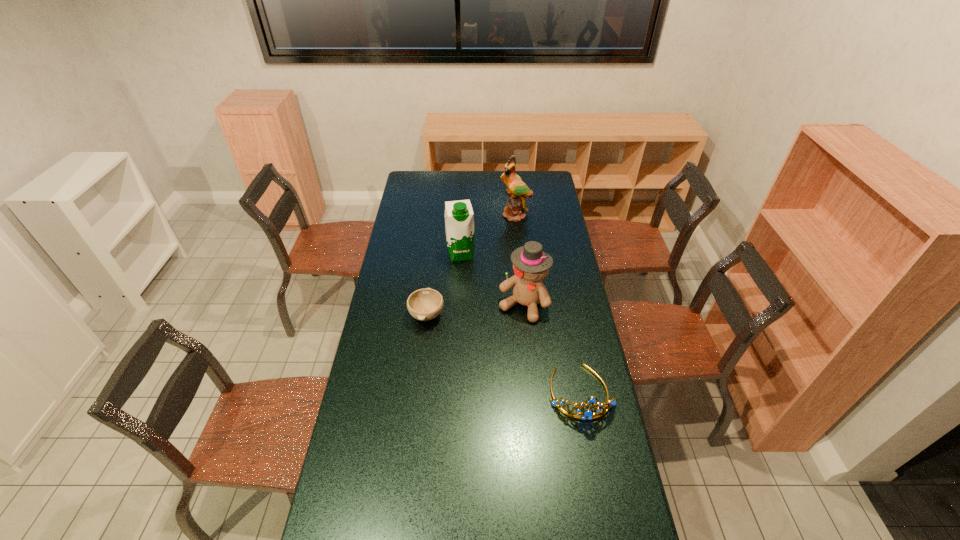
The height and width of the screenshot is (540, 960). I want to click on rag_doll present at the right edge, so click(x=531, y=265).

Image resolution: width=960 pixels, height=540 pixels. Find the location of `free space at the far edge`. free space at the far edge is located at coordinates (459, 178).

I want to click on vacant region at the left edge of the desktop, so click(389, 313).

Identify the location of free space at the right edge of the desktop. (553, 218).

You are a GUI agent. You are given a task and a screenshot of the screen. Output one action in this format:
    pyautogui.click(x=<x>, y=<y>)
    Task: Click on the free location at the far left corner
    The image size is (960, 540).
    Given the screenshot: What is the action you would take?
    pyautogui.click(x=412, y=174)

The width and height of the screenshot is (960, 540). In order to click on free space at the far right corner of the desktop in this screenshot , I will do `click(546, 177)`.

Identify the location of free space that is in between the bowl and the second farthest object. (444, 284).

Image resolution: width=960 pixels, height=540 pixels. I want to click on empty space that is in between the soya milk and the tiara, so pos(520,323).

Where is `empty space between the tallest object and the bowl`? The height and width of the screenshot is (540, 960). empty space between the tallest object and the bowl is located at coordinates (471, 265).

This screenshot has width=960, height=540. What are the coordinates of `empty space that is in between the soya milk and the rag_doll` in the screenshot? It's located at (492, 279).